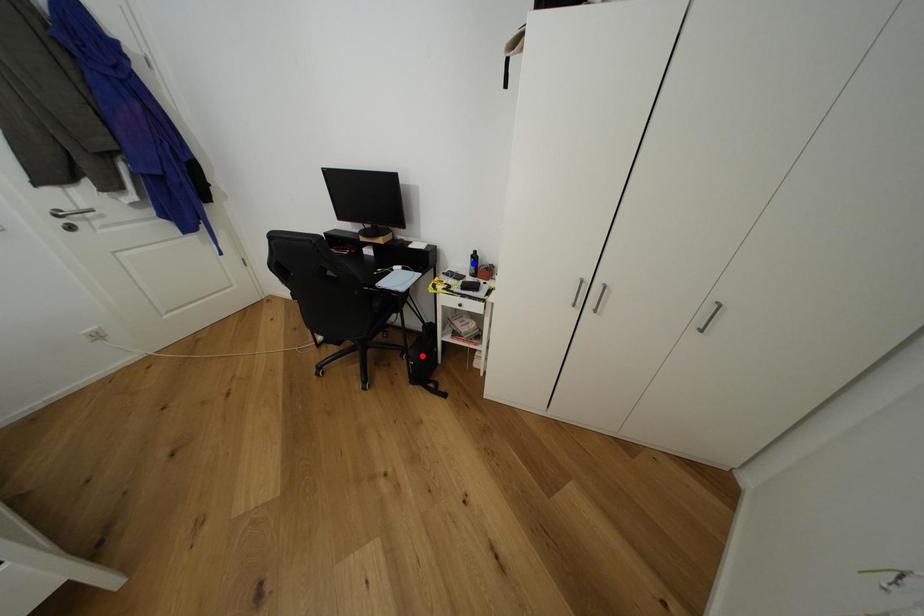
Question: Which of the two points in the image is closer to the camera?

Choices:
 (A) Blue point is closer.
 (B) Red point is closer.

Answer: (A)